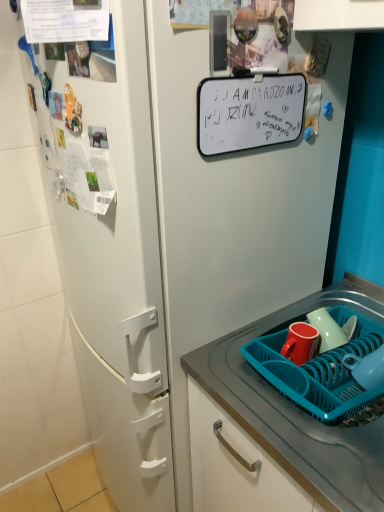
Find the location of a particular element. free space on the front side of matte red mug at lower right is located at coordinates (301, 388).